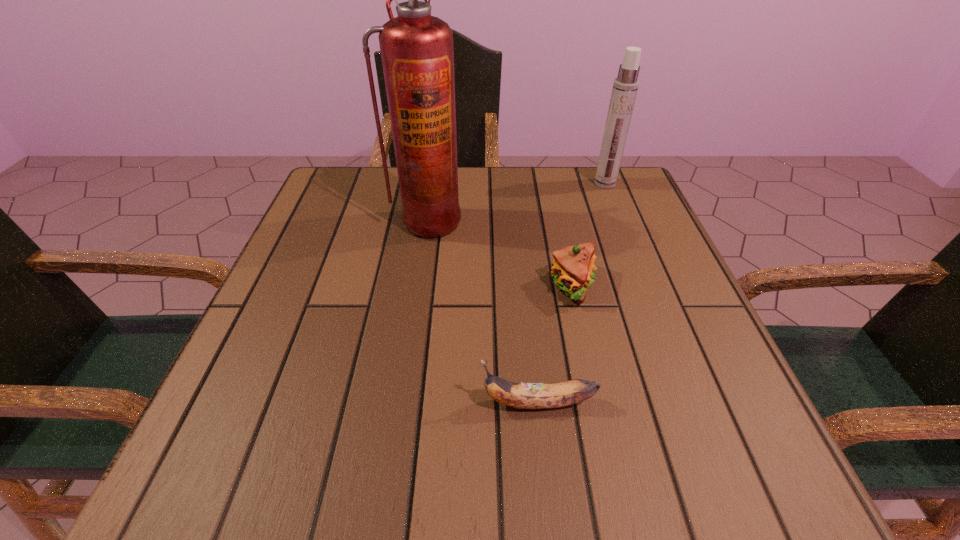
This screenshot has width=960, height=540. In order to click on object that is the closest to the fire extinguisher in this screenshot , I will do `click(573, 266)`.

The image size is (960, 540). I want to click on object that is the second closest to the tallest object, so click(625, 86).

Identify the location of vacant space that satisfies the following two spatial constraints: 1. on the side of the third nearest object with the label; 2. on the right side of the sandwich. (419, 286).

Where is `free space that satisfies the following two spatial constraints: 1. on the side of the sandwich with the label; 2. on the left side of the leftmost object`? free space that satisfies the following two spatial constraints: 1. on the side of the sandwich with the label; 2. on the left side of the leftmost object is located at coordinates (419, 286).